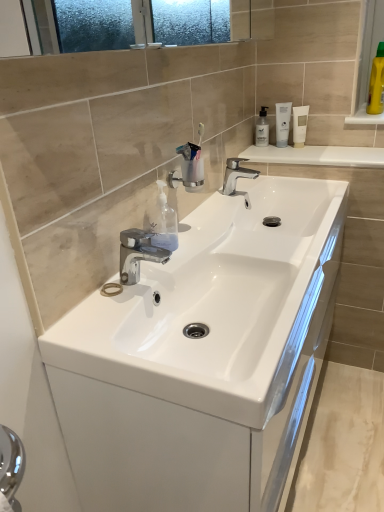
Where is `free space in front of chrome metallic faucet at center, the first tap in the bottom-to-top sequence`? free space in front of chrome metallic faucet at center, the first tap in the bottom-to-top sequence is located at coordinates (112, 323).